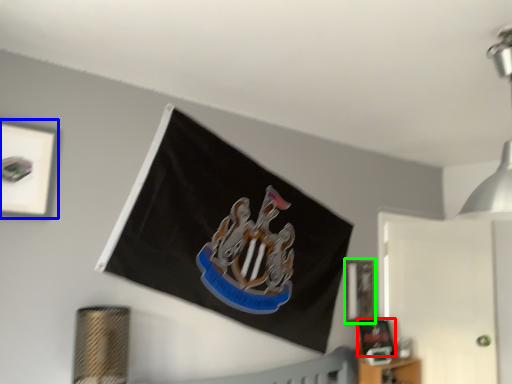
Question: Which object is the farthest from picture frame (highlighted by a red box)? Choose among these: picture frame (highlighted by a blue box) or picture frame (highlighted by a green box).

Choices:
 (A) picture frame
 (B) picture frame

Answer: (A)